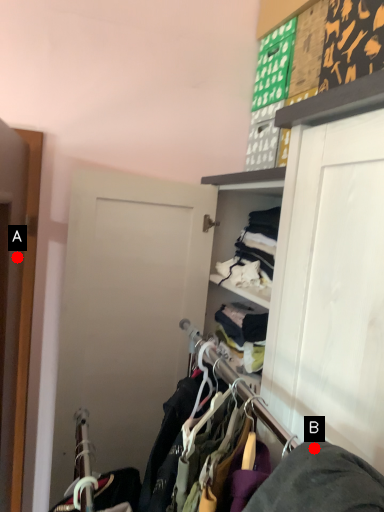
Question: Two points are circled on the image, labeled by A and B beside each circle. Among these points, which one is nearest to the camera?

Choices:
 (A) A is closer
 (B) B is closer

Answer: (B)